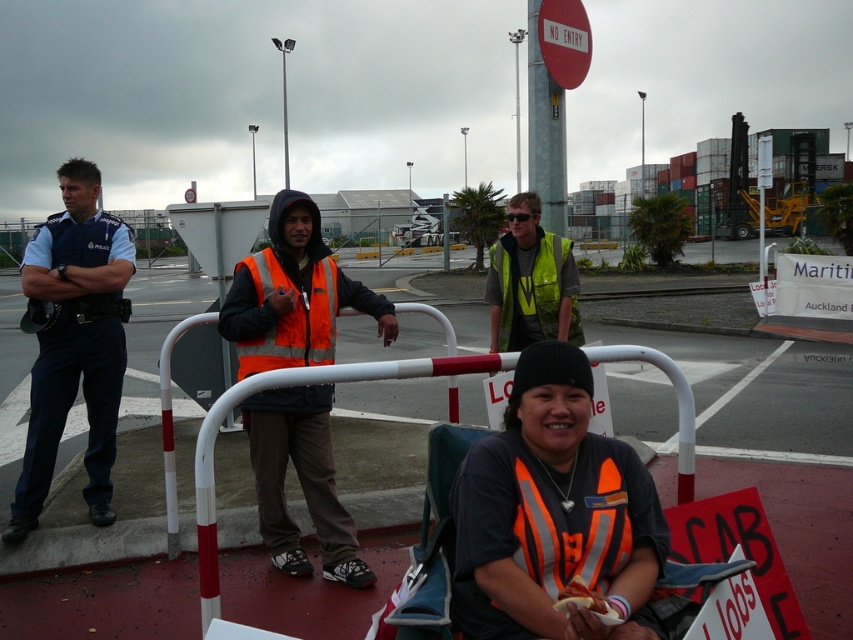
Does reflective orange vest at center appear over blue uniform at left?

Yes, reflective orange vest at center is above blue uniform at left.

Find the location of a particular element. reflective orange vest at center is located at coordinates (293, 294).

Between point (340, 280) and point (45, 353), which one is positioned in front?

Point (340, 280)

Identify the location of reflective orange vest at center. (293, 294).

Is blue uniform at left positioned at the back of metallic pole at upper center?

No, it is not.

Does blue uniform at left have a lesser width compared to metallic pole at upper center?

No, blue uniform at left is not thinner than metallic pole at upper center.

Does point (59, 404) lie in front of point (531, 188)?

Yes, it is in front of point (531, 188).

Where is `blue uniform at left`? blue uniform at left is located at coordinates (74, 342).

The image size is (853, 640). What do you see at coordinates (74, 342) in the screenshot?
I see `blue uniform at left` at bounding box center [74, 342].

Where is `blue uniform at left`? blue uniform at left is located at coordinates (74, 342).

Locate an element on the screen. blue uniform at left is located at coordinates (74, 342).